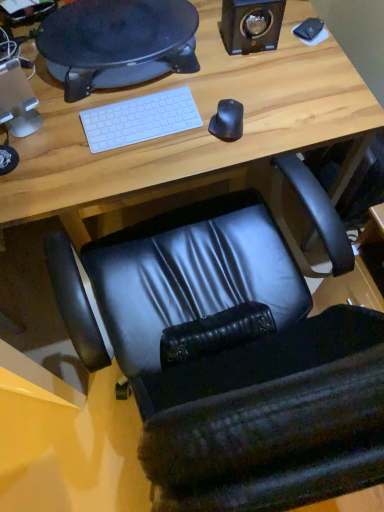
Identify the location of vacant region to the left of black rubber mouse at center. This screenshot has height=512, width=384. (170, 149).